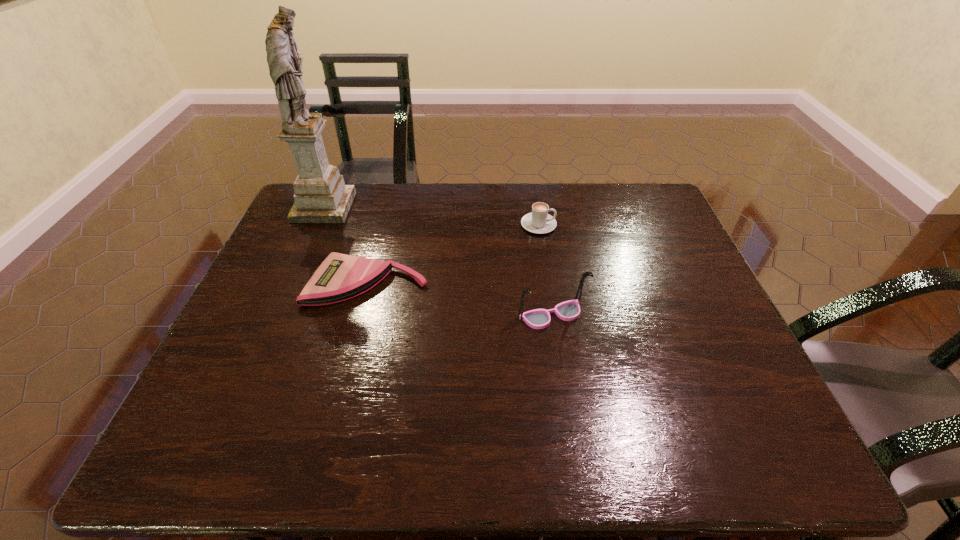
Find the location of `the tallest object`. the tallest object is located at coordinates (321, 196).

Identify the location of the second tallest object. Image resolution: width=960 pixels, height=540 pixels. (569, 310).

At what (x,y) coordinates should I click in order to perform the action: click on the third tallest object. Please return your answer as a coordinate pair (x, y). Looking at the image, I should click on (538, 221).

Identify the location of the shortest object. The image size is (960, 540). (340, 277).

Image resolution: width=960 pixels, height=540 pixels. I want to click on free space located 0.330m on the front-facing side of the sculpture, so click(453, 207).

This screenshot has width=960, height=540. I want to click on free space located 0.320m on the back of the second tallest object, so click(x=538, y=224).

Image resolution: width=960 pixels, height=540 pixels. In order to click on blank space located to the right of the cappuccino in this screenshot , I will do `click(628, 225)`.

Where is `vacant area situated on the back of the shortest object`? vacant area situated on the back of the shortest object is located at coordinates (387, 210).

Where is `sculpture located in the far edge section of the desktop`? The height and width of the screenshot is (540, 960). sculpture located in the far edge section of the desktop is located at coordinates (321, 196).

The width and height of the screenshot is (960, 540). Find the location of `cappuccino that is at the far edge`. cappuccino that is at the far edge is located at coordinates (538, 221).